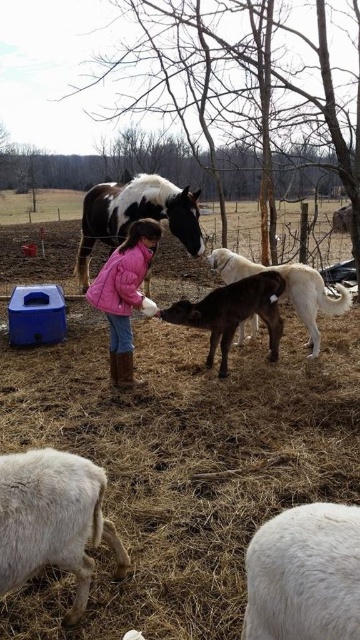
Question: Among these objects, which one is nearest to the camera?

Choices:
 (A) black smooth calf at center
 (B) brown glossy pony at center
 (C) white woolen sheep at lower left

Answer: (C)

Question: Estimate the real-world distances between objects in this image. Which object is farther from the spotted glossy horse at center?

Choices:
 (A) white woolen sheep at lower right
 (B) black smooth calf at center
 (C) pink fuzzy jacket at center

Answer: (A)

Question: Which object appears closest to the camera in this image?

Choices:
 (A) spotted glossy horse at center
 (B) black smooth calf at center
 (C) brown glossy pony at center

Answer: (B)

Question: Is smooth brown calf at center closer to the viewer compared to white woolen sheep at lower left?

Choices:
 (A) yes
 (B) no

Answer: (B)

Question: Does white woolen sheep at lower left appear on the left side of brown glossy pony at center?

Choices:
 (A) no
 (B) yes

Answer: (B)

Question: Is smooth brown calf at center further to the viewer compared to spotted glossy horse at center?

Choices:
 (A) yes
 (B) no

Answer: (B)